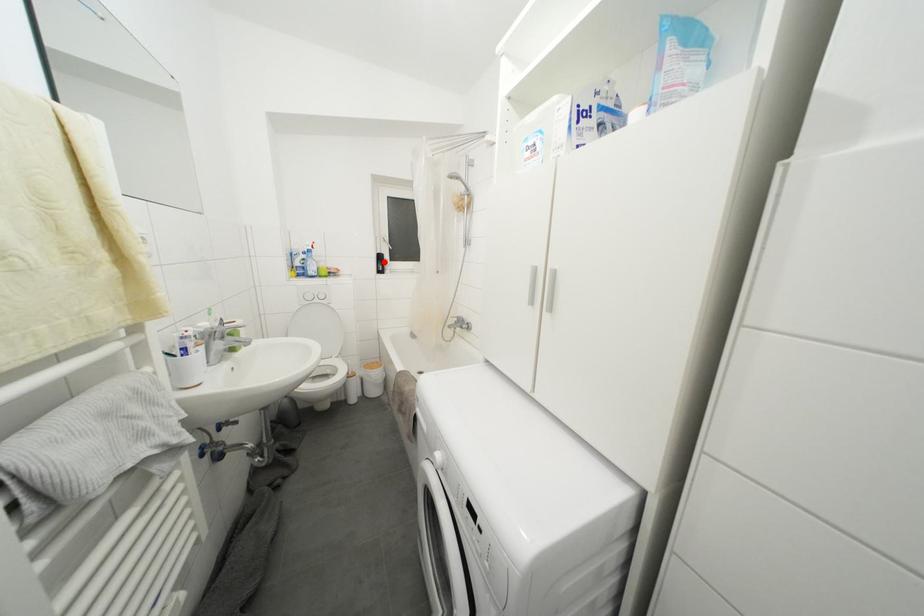
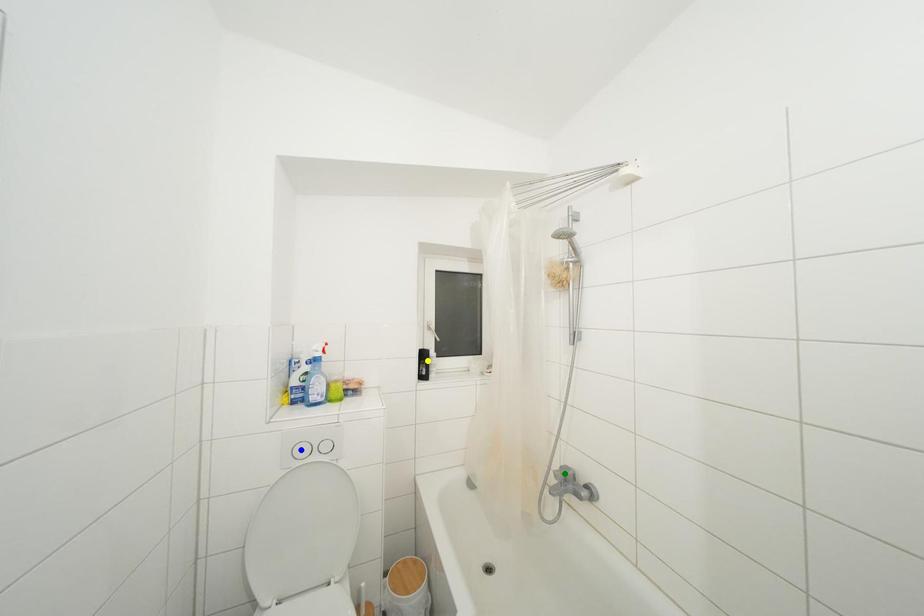
Question: I am providing you with two images of the same scene from different viewpoints. A red point is marked on the first image. You are given multiple points on the second image. Which mark in image 2 goes with the point in image 1?

Choices:
 (A) green point
 (B) yellow point
 (C) blue point

Answer: (B)